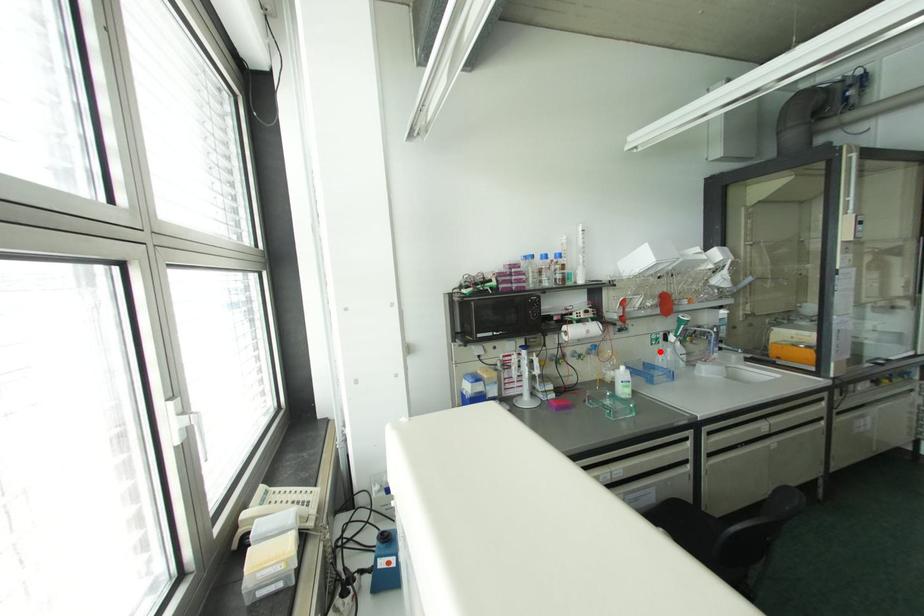
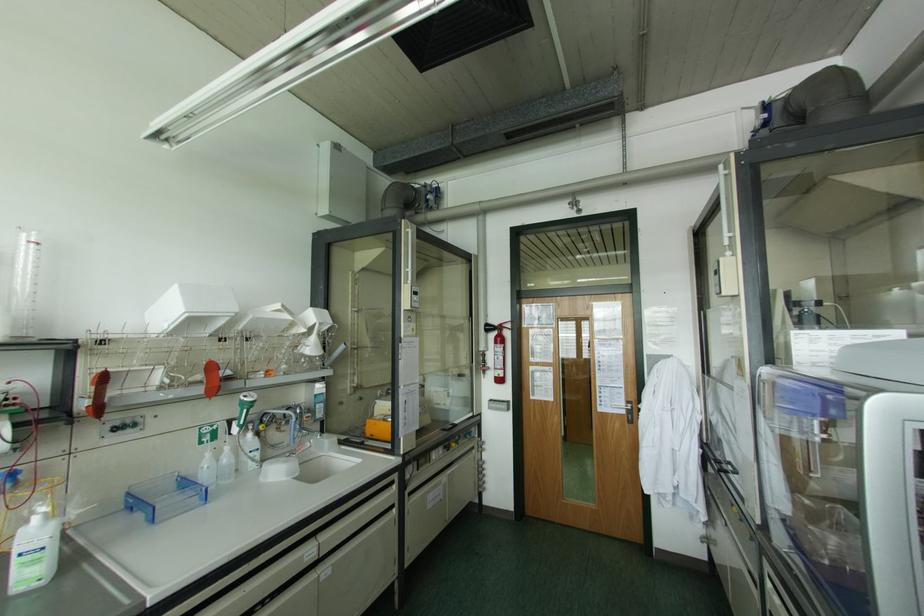
Question: A red point is marked in image1. In image2, is the corresponding 3D point closer to the camera or farther? Reply with the corresponding letter.

Choices:
 (A) The corresponding 3D point is closer.
 (B) The corresponding 3D point is farther.

Answer: (A)